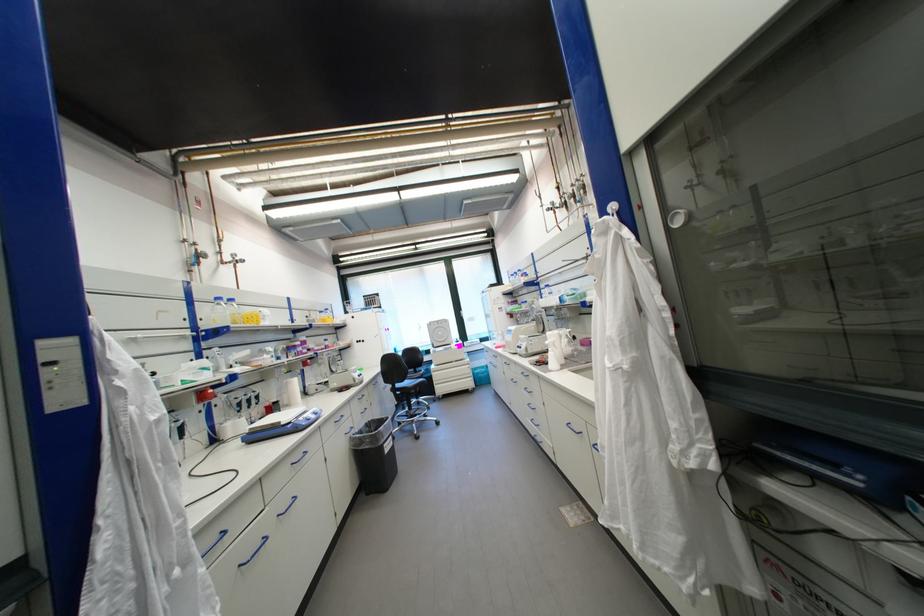
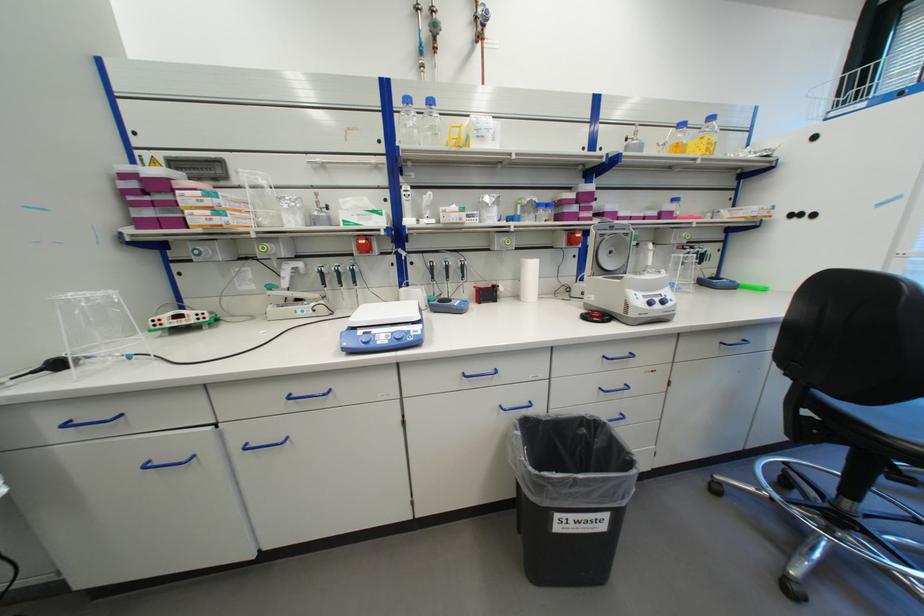
Where in the second image is the point corresponding to [307,344] from the first image?

(579, 197)